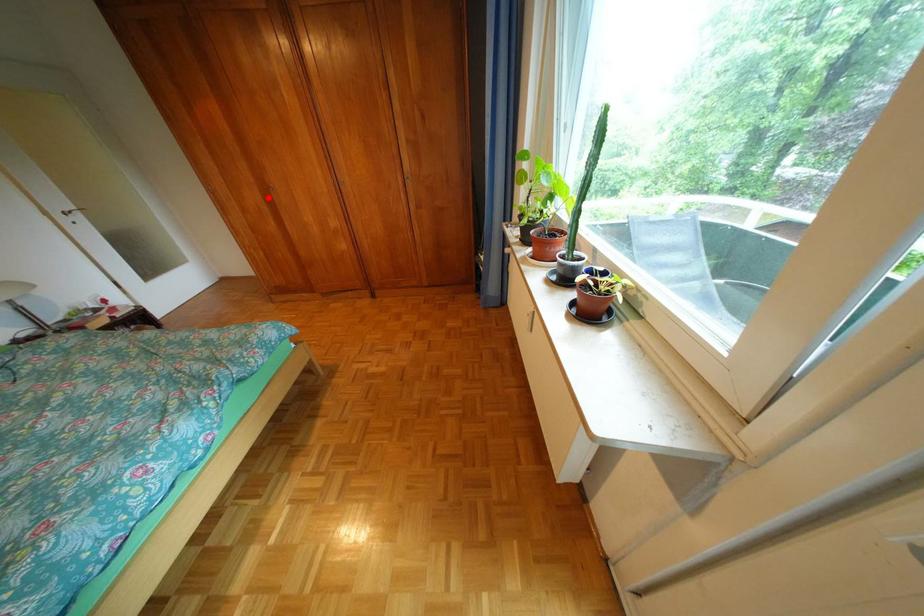
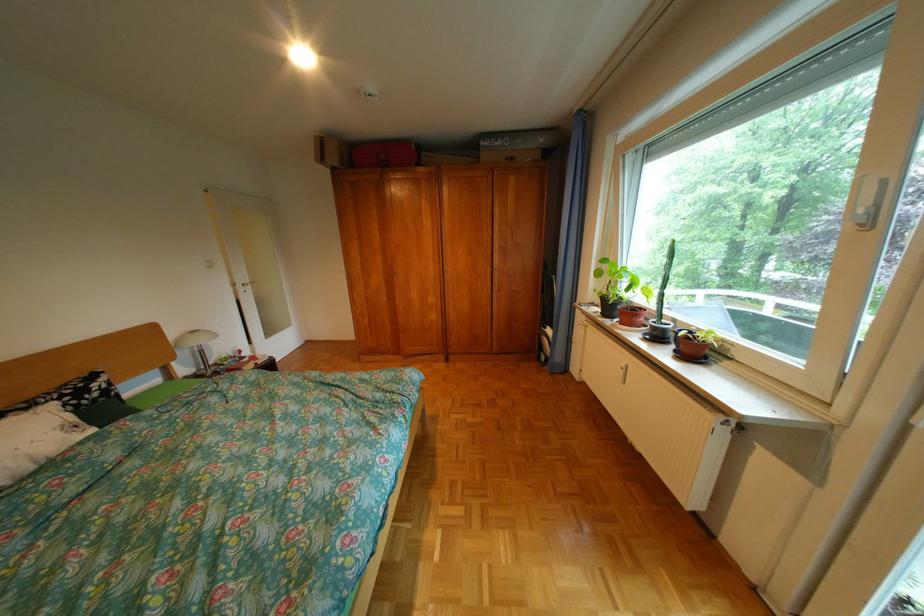
Where in the second image is the point corresponding to the highlighted location from the first image?

(392, 280)